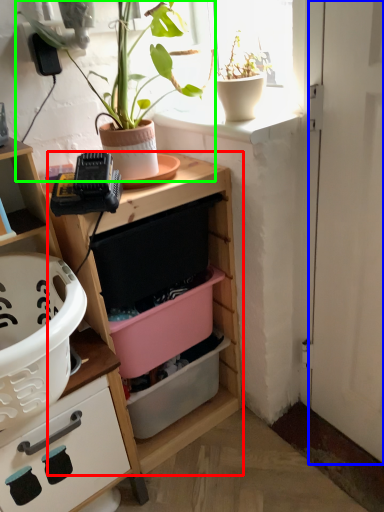
Question: Considering the real-world distances, which object is farthest from shelf (highlighted by a red box)? door (highlighted by a blue box) or houseplant (highlighted by a green box)?

Choices:
 (A) door
 (B) houseplant

Answer: (B)